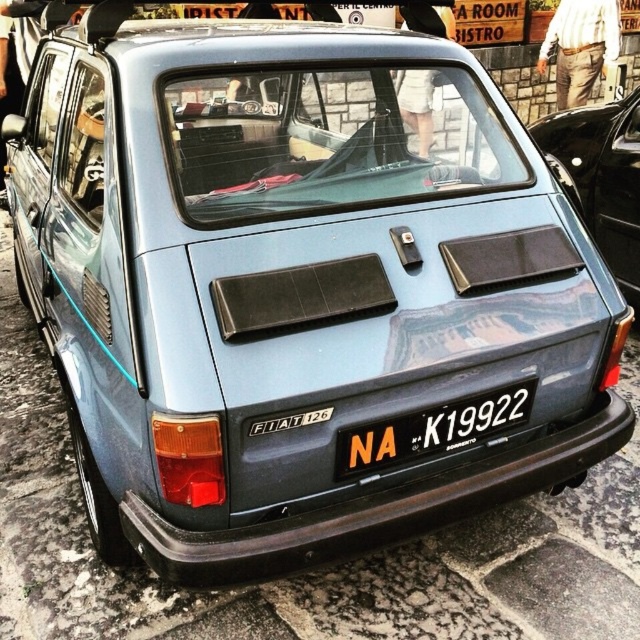
You are a photographer standing on the cobblestone street, wanting to capture the Fiat 126 in your shot. You notice the metallic blue car at center and the white plastic license plate at center. Which object is taller in the image?

The metallic blue car at center is taller than the white plastic license plate at center.

Consider the image. You are a delivery driver who needs to attach a package to the roof of the metallic blue car at center. However, the package is wider than the car itself. Can you place it so that it extends equally to both sides of the car without overlapping the white plastic license plate at center?

The metallic blue car at center is to the right of the white plastic license plate at center. Since the license plate is at the center of the car, the car itself is positioned to the right of the license plate. This suggests that the license plate is centered on the car, so placing the package to extend equally on both sides should be possible without overlapping the license plate. However, since the car is to the right of the license plate, the license plate might be slightly offset, so the driver should

You are standing on the cobblestone street looking at the vintage Fiat 126 parked at center. There is a point marked at coordinates (x=604, y=177). Can you determine which object this point is located on?

The point at coordinates (x=604, y=177) is on the metallic blue car at center.